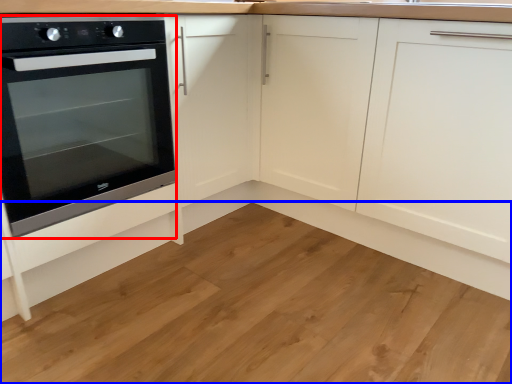
Question: Which object is closer to the camera taking this photo, oven (highlighted by a red box) or hardwood (highlighted by a blue box)?

Choices:
 (A) oven
 (B) hardwood

Answer: (B)